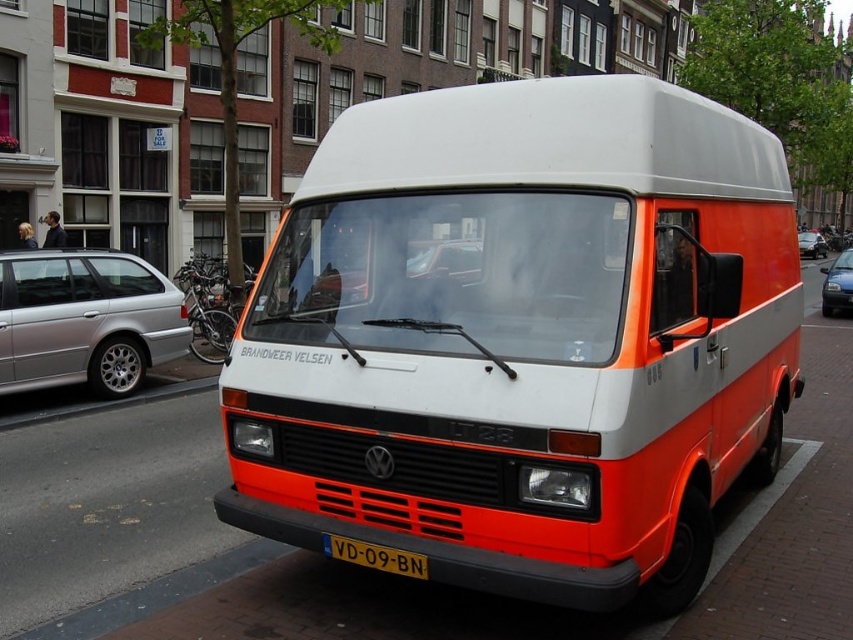
Question: Which object is the closest to the orange matte van at center?

Choices:
 (A) metallic silver car at center
 (B) metallic blue sedan at center
 (C) silver metallic car at left

Answer: (C)

Question: Is orange matte van at center positioned behind metallic blue sedan at center?

Choices:
 (A) no
 (B) yes

Answer: (A)

Question: Can you confirm if yellow plastic license plate at center is smaller than metallic silver car at center?

Choices:
 (A) no
 (B) yes

Answer: (B)

Question: Among these objects, which one is nearest to the camera?

Choices:
 (A) silver metallic car at left
 (B) orange matte van at center
 (C) metallic silver car at center

Answer: (B)

Question: Is orange matte van at center wider than metallic silver car at center?

Choices:
 (A) no
 (B) yes

Answer: (B)

Question: Among these points, which one is farthest from the camera?

Choices:
 (A) (801, 236)
 (B) (45, 278)
 (C) (842, 296)
 (D) (607, 96)

Answer: (A)